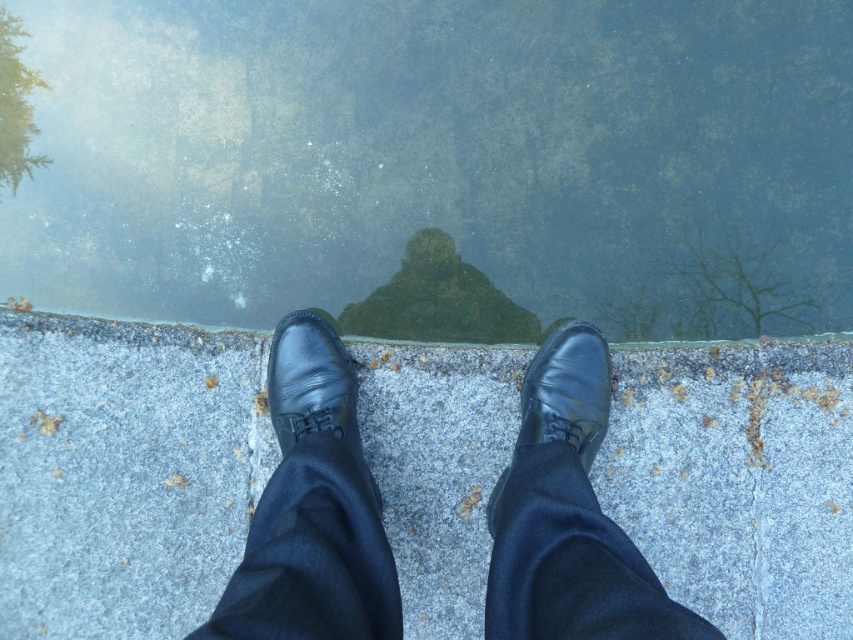
Question: Is transparent water at center thinner than gray concrete at center?

Choices:
 (A) no
 (B) yes

Answer: (A)

Question: Is gray concrete at center to the left of black leather shoe at center from the viewer's perspective?

Choices:
 (A) yes
 (B) no

Answer: (B)

Question: Which point is closer to the camera?

Choices:
 (A) (352, 406)
 (B) (750, 42)
 (C) (778, 467)
 (D) (583, 464)

Answer: (D)

Question: Which point is closer to the camera?

Choices:
 (A) (529, 112)
 (B) (525, 435)
 (C) (432, 506)

Answer: (B)

Question: Which of these objects is positioned farthest from the shiny black shoe at center?

Choices:
 (A) gray concrete at center
 (B) black leather shoe at center
 (C) transparent water at center

Answer: (C)

Question: Is gray concrete at center to the right of black leather shoe at center from the viewer's perspective?

Choices:
 (A) yes
 (B) no

Answer: (A)